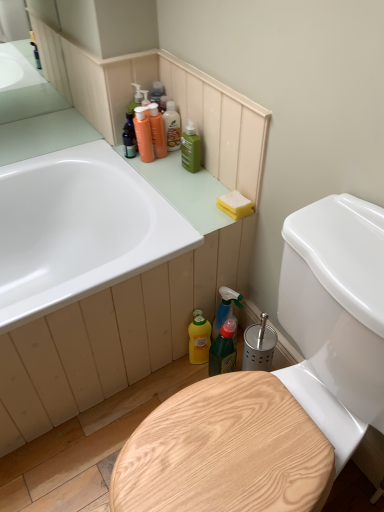
I want to click on vacant space in front of matte orange bottles at upper left, which ranks as the 3th cleaning product in top-to-bottom order, so click(x=160, y=178).